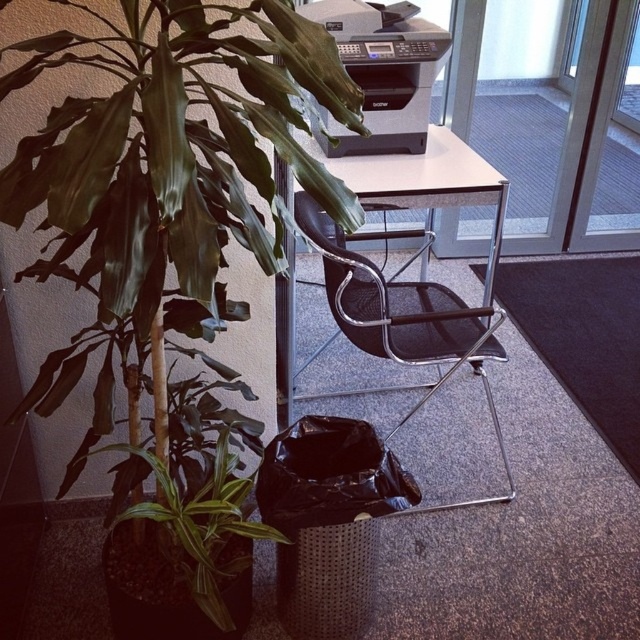
Does transparent glass door at upper center lie in front of black plastic printer at upper center?

No, transparent glass door at upper center is further to the viewer.

Measure the distance from transparent glass door at upper center to black plastic printer at upper center.

transparent glass door at upper center and black plastic printer at upper center are 1.05 meters apart from each other.

Between point (547, 160) and point (371, 77), which one is positioned in front?

Point (371, 77) is more forward.

The width and height of the screenshot is (640, 640). What are the coordinates of `transparent glass door at upper center` in the screenshot? It's located at (550, 124).

Which is in front, point (65, 157) or point (400, 93)?

Positioned in front is point (65, 157).

Can you confirm if green glossy leafy plant at left is shorter than black plastic printer at upper center?

In fact, green glossy leafy plant at left may be taller than black plastic printer at upper center.

Who is more forward, [72,460] or [387,52]?

Positioned in front is point [72,460].

This screenshot has width=640, height=640. In order to click on green glossy leafy plant at left in this screenshot , I will do `click(170, 260)`.

Who is positioned more to the right, green glossy leafy plant at left or transparent glass door at upper center?

transparent glass door at upper center is more to the right.

Can you confirm if green glossy leafy plant at left is thinner than transparent glass door at upper center?

Indeed, green glossy leafy plant at left has a lesser width compared to transparent glass door at upper center.

Is point (124, 360) less distant than point (468, 28)?

Yes, it is in front of point (468, 28).

Find the location of a particular element. green glossy leafy plant at left is located at coordinates (170, 260).